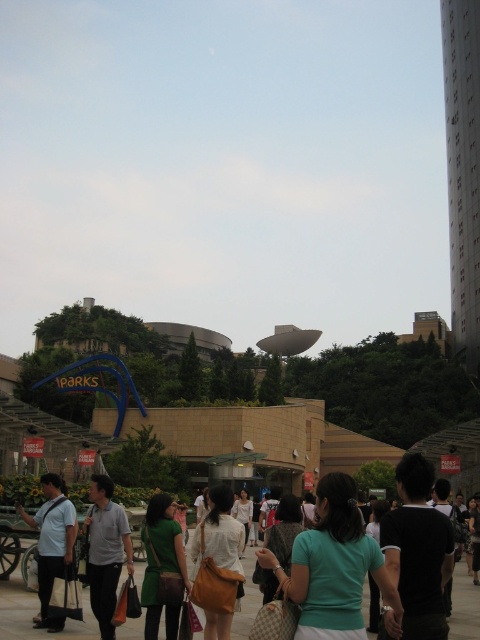
Question: Is gray cotton shirt at lower left above light blue shirt at center?

Choices:
 (A) yes
 (B) no

Answer: (B)

Question: Which object appears farthest from the camera in this image?

Choices:
 (A) green fabric crowd at center
 (B) matte green dress at center
 (C) gray cotton shirt at lower left

Answer: (C)

Question: Which point is closer to the camera taking this photo?

Choices:
 (A) (200, 540)
 (B) (153, 554)
 (C) (12, 593)

Answer: (B)

Question: Does gray cotton shirt at lower left appear under matte white shirt at center?

Choices:
 (A) no
 (B) yes

Answer: (B)

Question: Can you confirm if green fabric crowd at center is wider than light blue shirt at center?

Choices:
 (A) no
 (B) yes

Answer: (B)

Question: Among these objects, which one is nearest to the camera?

Choices:
 (A) light blue shirt at center
 (B) green fabric crowd at center
 (C) gray cotton shirt at lower left

Answer: (B)